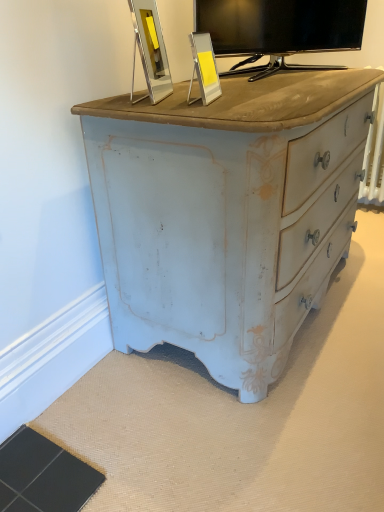
Question: Considering their positions, is silver metallic picture frame at upper center, the 2th picture frame from the right, located in front of or behind matte black tv at upper center?

Choices:
 (A) front
 (B) behind

Answer: (A)

Question: Considering the relative positions of silver metallic picture frame at upper center, the 2th picture frame from the right, and matte black tv at upper center in the image provided, is silver metallic picture frame at upper center, the 2th picture frame from the right, to the left or to the right of matte black tv at upper center?

Choices:
 (A) right
 (B) left

Answer: (B)

Question: Considering the real-world distances, which object is closest to the silver metallic picture frame at upper center, the 2th picture frame from the right?

Choices:
 (A) matte black tv at upper center
 (B) metallic silver picture frame at upper center, acting as the 2th picture frame starting from the left

Answer: (B)

Question: Which is nearer to the metallic silver picture frame at upper center, which is the 1th picture frame from right to left?

Choices:
 (A) silver metallic picture frame at upper center, which is the first picture frame from left to right
 (B) matte black tv at upper center

Answer: (A)